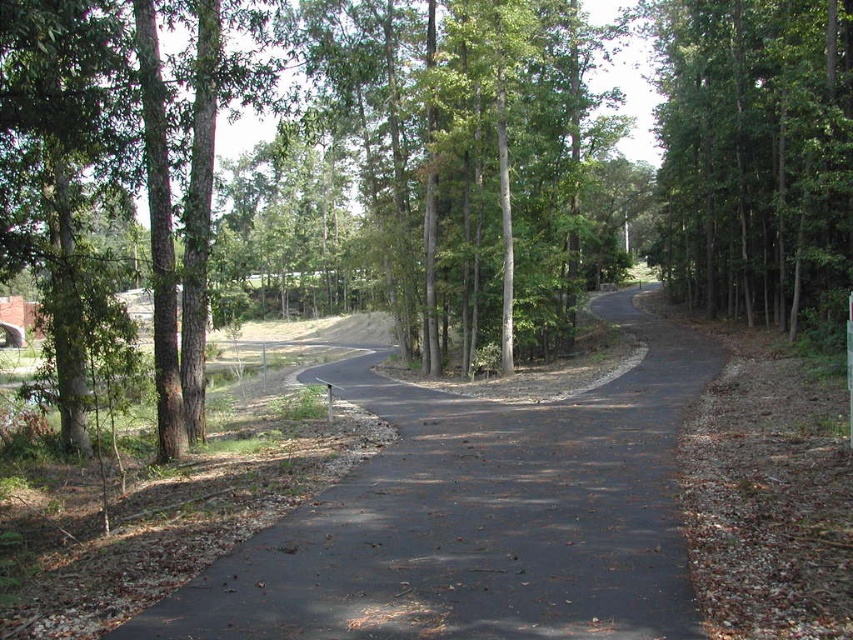
Question: Among these objects, which one is farthest from the camera?

Choices:
 (A) black asphalt road at center
 (B) green leafy tree at right

Answer: (B)

Question: In this image, where is black asphalt road at center located relative to green leafy tree at right?

Choices:
 (A) below
 (B) above

Answer: (A)

Question: Among these points, which one is farthest from the camera?

Choices:
 (A) (811, 168)
 (B) (318, 614)

Answer: (A)

Question: Does black asphalt road at center appear over green leafy tree at right?

Choices:
 (A) yes
 (B) no

Answer: (B)

Question: Is black asphalt road at center smaller than green leafy tree at right?

Choices:
 (A) no
 (B) yes

Answer: (B)